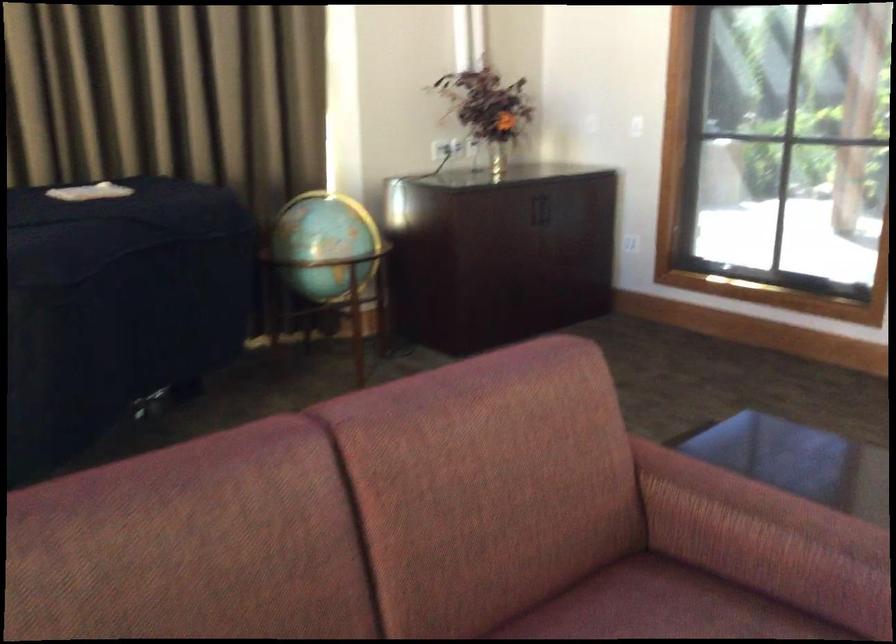
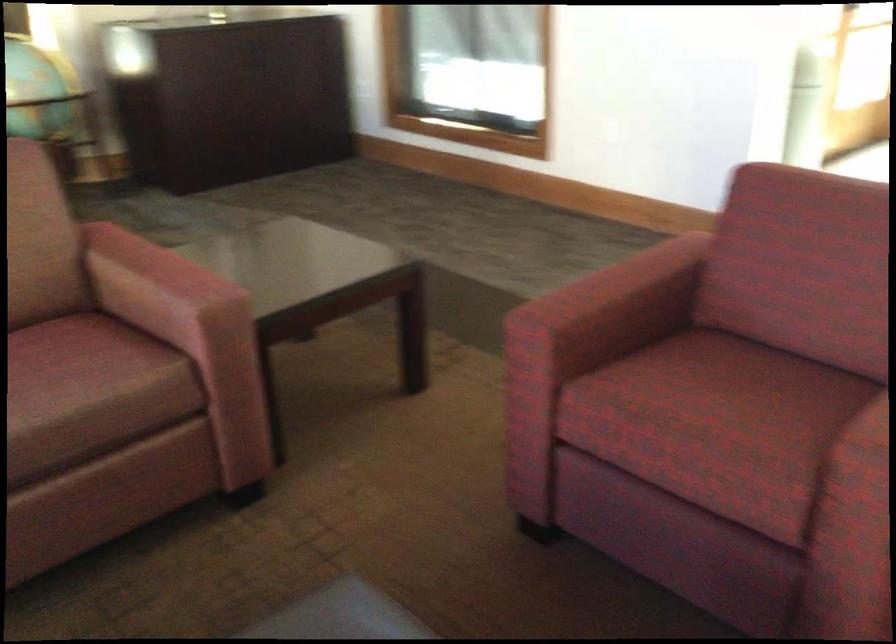
Which direction would the cameraman need to move to produce the second image?

The cameraman walked toward right, backward.